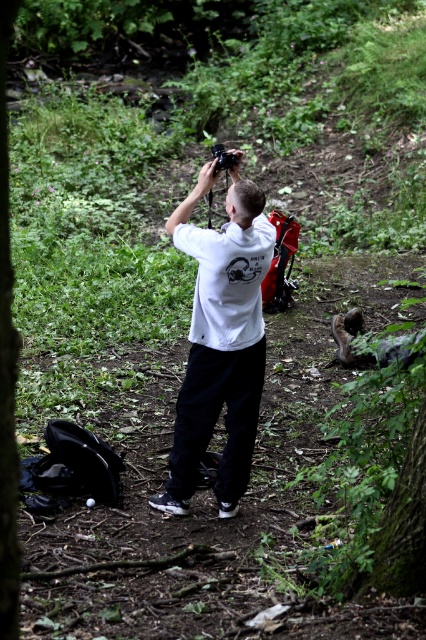
Between white matte hoodie at center and green leafy tree at center, which one is positioned higher?

Positioned higher is green leafy tree at center.

Is point (244, 304) positioned after point (2, 163)?

Yes, it is behind point (2, 163).

Locate an element on the screen. Image resolution: width=426 pixels, height=640 pixels. white matte hoodie at center is located at coordinates (221, 340).